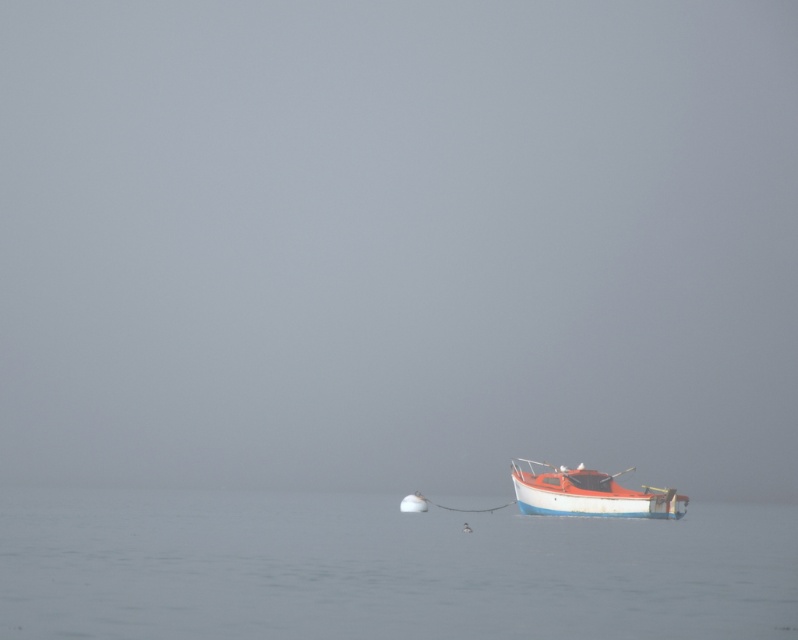
You are standing on the dock and see the matte white boat at lower right and the white matte buoy at center. Which object is positioned further to the east? Please explain your reasoning based on their spatial arrangement.

The matte white boat at lower right is to the right of the white matte buoy at center. Since the boat is at the lower right and the buoy is at the center, the boat is positioned further to the east compared to the buoy.

You are navigating a small boat and need to anchor it in the smooth water at boat right. According to the coordinates provided, where exactly should you position the anchor relative to the boat?

The smooth water at boat right is located at point (381,568), so you should position the anchor at those coordinates relative to the boat.